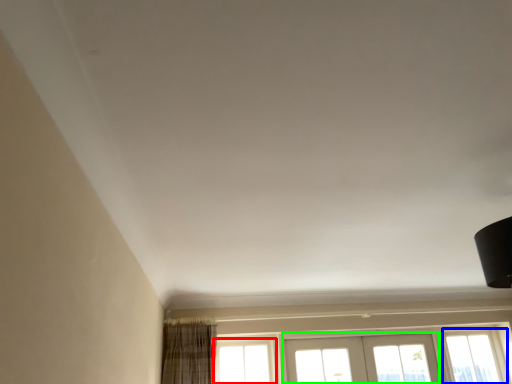
Question: Which object is the closest to the window (highlighted by a red box)? Choose among these: window (highlighted by a blue box) or screen door (highlighted by a green box).

Choices:
 (A) window
 (B) screen door

Answer: (B)